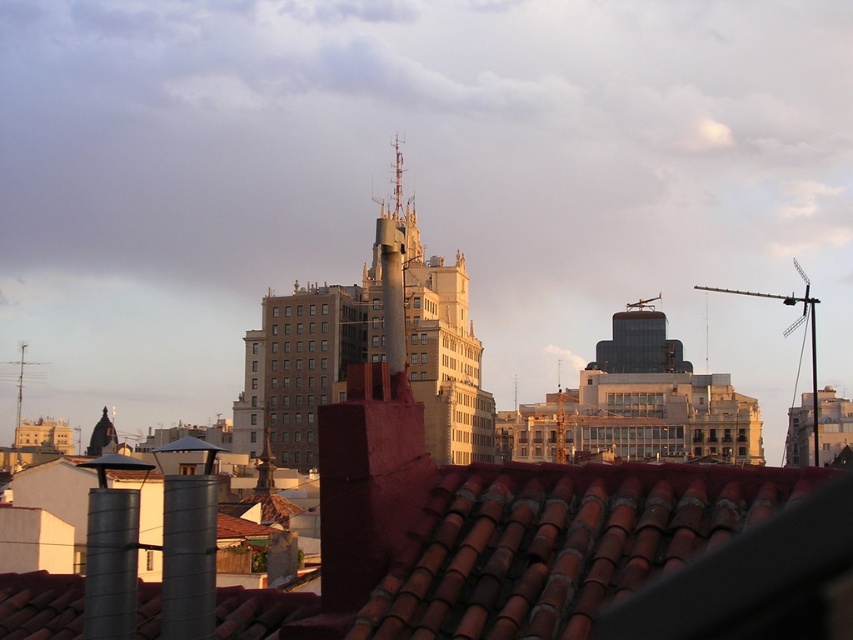
You are standing on the rooftop and want to install a new satellite dish between the smooth concrete tower at center and the metallic antenna at left. Based on their positions, which object should you place the dish closer to in order to align it with the city skyline?

The smooth concrete tower at center is positioned on the right side of the metallic antenna at left, so to align the satellite dish with the city skyline, it should be placed closer to the metallic antenna at left to ensure proper alignment with the skyline.